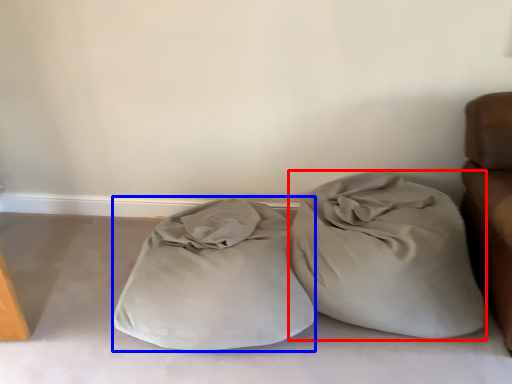
Question: Which point is closer to the camera, throw pillow (highlighted by a red box) or pillow (highlighted by a blue box)?

Choices:
 (A) throw pillow
 (B) pillow

Answer: (B)